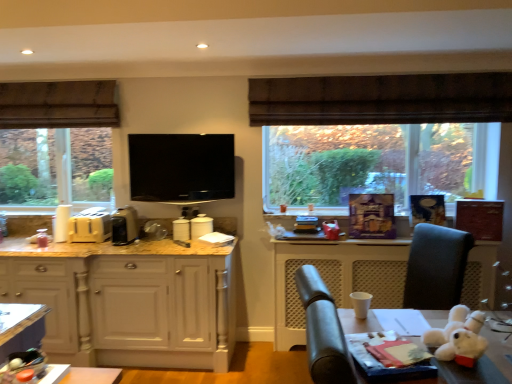
The height and width of the screenshot is (384, 512). I want to click on free location in front of metallic silver coffee machine at left, which ranks as the 3th appliance in right-to-left order, so click(120, 247).